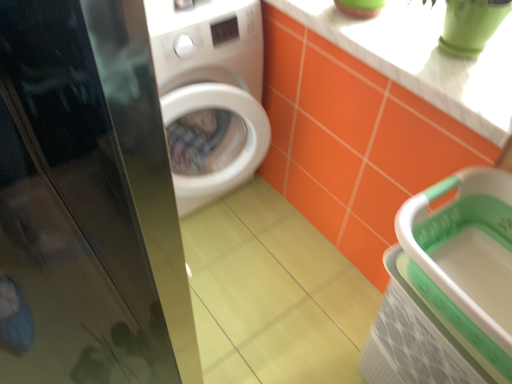
Question: From a real-world perspective, is white glossy counter top at upper right above or below glossy black screen door at left?

Choices:
 (A) below
 (B) above

Answer: (A)

Question: In terms of width, does white glossy counter top at upper right look wider or thinner when compared to glossy black screen door at left?

Choices:
 (A) wide
 (B) thin

Answer: (A)

Question: Estimate the real-world distances between objects in this image. Which object is closer to the white glossy counter top at upper right?

Choices:
 (A) glossy black screen door at left
 (B) green plastic basket at lower right

Answer: (B)

Question: Which of these objects is positioned closest to the glossy black screen door at left?

Choices:
 (A) green plastic basket at lower right
 (B) white glossy counter top at upper right

Answer: (A)